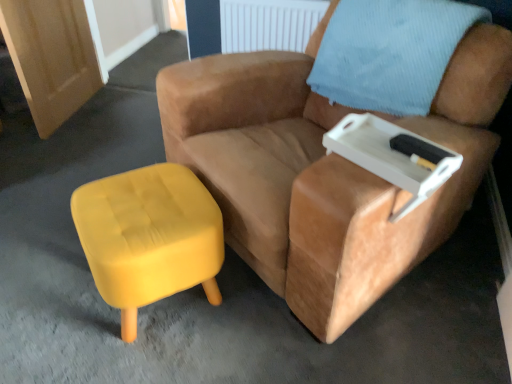
Identify the location of free location to the right of yellow fabric stool at lower left. The width and height of the screenshot is (512, 384). (246, 320).